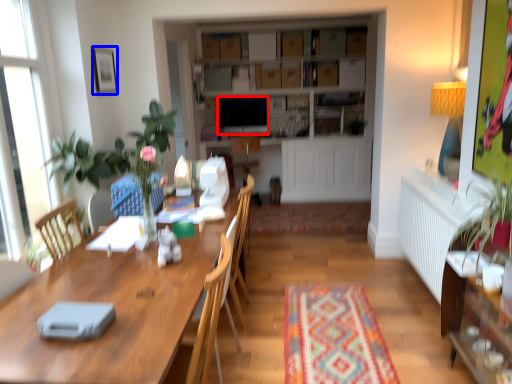
Question: Which object appears closest to the camera in this image, television (highlighted by a red box) or picture frame (highlighted by a blue box)?

Choices:
 (A) television
 (B) picture frame

Answer: (B)